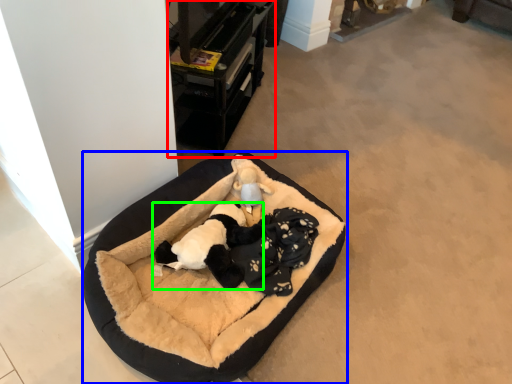
Question: Which object is the farthest from furniture (highlighted by a red box)? Choose among these: dog bed (highlighted by a blue box) or animal (highlighted by a green box).

Choices:
 (A) dog bed
 (B) animal

Answer: (B)